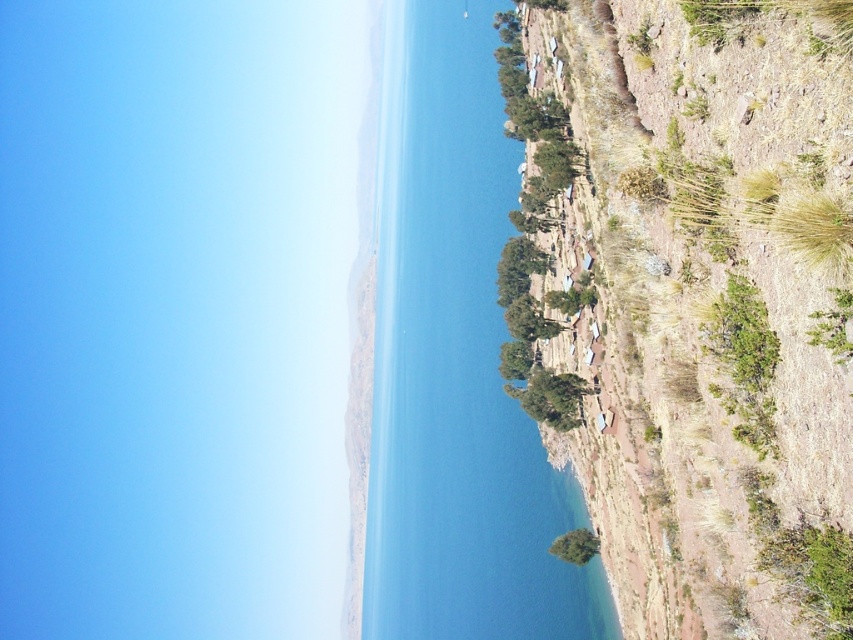
You are standing at the origin point in the image and want to reach the point labeled point (596,540). Is the point labeled point (450,61) blocking your path?

Point (450,61) is behind point (596,540), so it is not blocking your path to point (596,540).

You are standing at the edge of the dry terrain on the right side of the image. You see the blue water at center and the green leafy bush at lower center. Which object is closer to your current position?

The green leafy bush at lower center is closer to your current position because it is located below the blue water at center, which is above it.